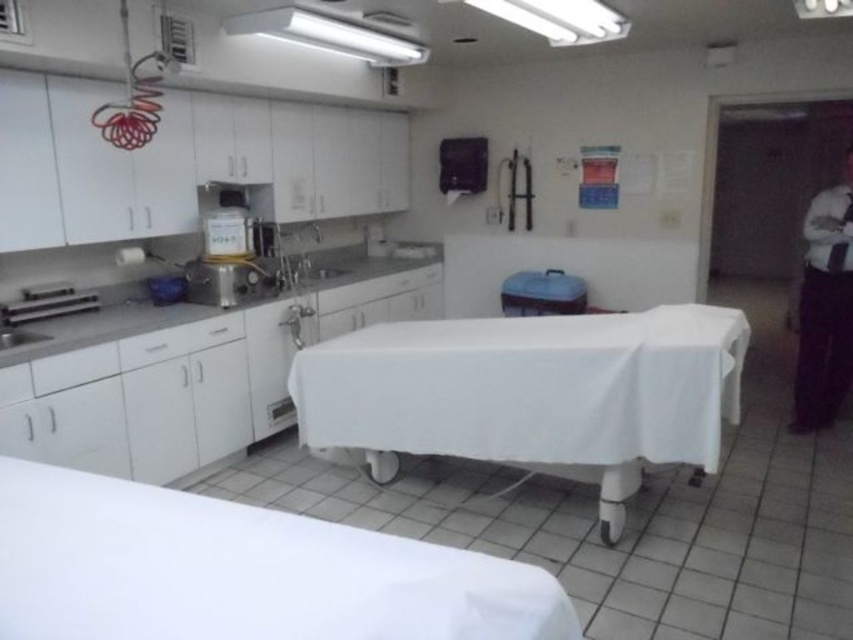
Is white plastic exhaust hood at upper center behind satin silver sink at center-left?

That is False.

Is point (251, 28) farther from viewer compared to point (200, 266)?

That is False.

Locate an element on the screen. white plastic exhaust hood at upper center is located at coordinates (329, 35).

Does point (231, 504) come closer to viewer compared to point (517, 397)?

That is True.

Measure the distance between white matte tablecloth at center and white matte table at center.

white matte tablecloth at center is 1.65 meters away from white matte table at center.

What do you see at coordinates (241, 572) in the screenshot?
I see `white matte tablecloth at center` at bounding box center [241, 572].

Where is `white matte tablecloth at center`? white matte tablecloth at center is located at coordinates (241, 572).

Does white matte tablecloth at center have a greater width compared to satin silver sink at center-left?

Yes, white matte tablecloth at center is wider than satin silver sink at center-left.

Does point (80, 525) come behind point (248, 300)?

No, it is not.

Find the location of a particular element. Image resolution: width=853 pixels, height=640 pixels. white matte tablecloth at center is located at coordinates (241, 572).